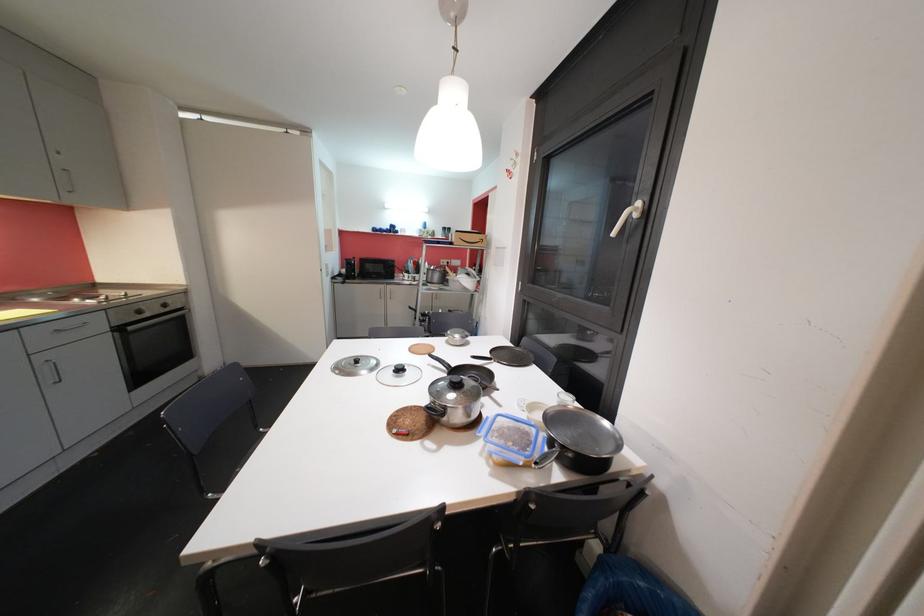
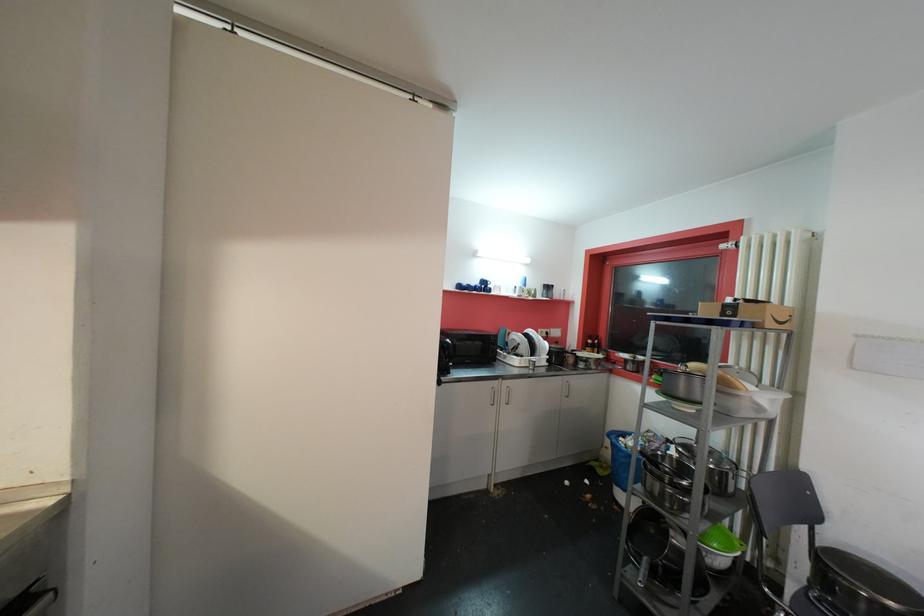
Based on the photo, in a continuous first-person perspective shot, in which direction is the camera moving?

The cameraman moved toward left, forward.